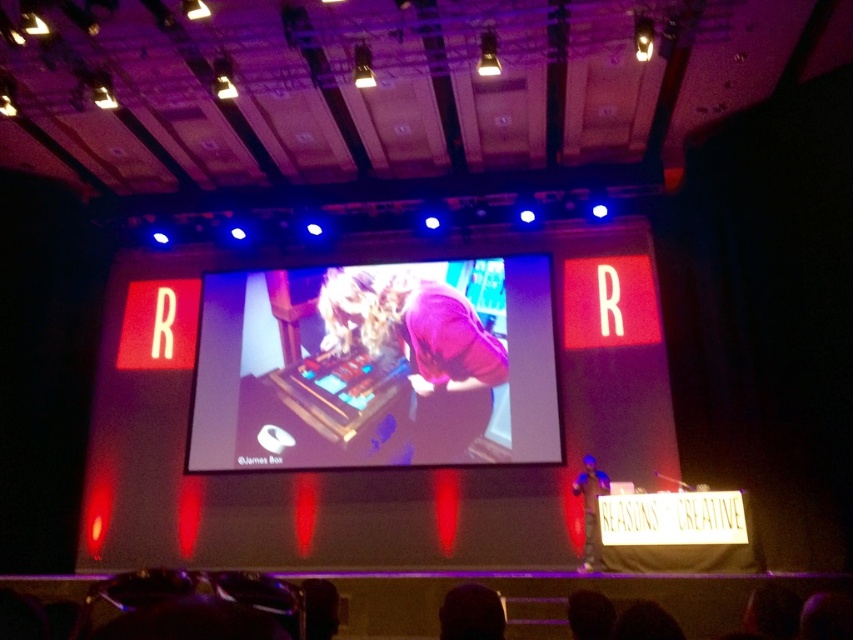
You are a photographer at the event and want to capture the purple matte shirt at center and the matte pink shirt at center clearly. Which shirt should you focus on to ensure the other is also in sharp focus?

The purple matte shirt at center is positioned over the matte pink shirt at center, so focusing on the purple matte shirt at center will keep both in sharp focus since they are layered.

You are an event photographer capturing the stage setup. You notice the dark hair at lower center and the matte pink shirt at center. Which object has a smaller width?

The dark hair at lower center is thinner than the matte pink shirt at center, so the dark hair at lower center has a smaller width.

You are an event organizer who needs to place a 3.5 meter long banner between the purple matte shirt at center and the matte pink shirt at center on stage. Will the banner fit without overlapping either shirt?

The distance between the purple matte shirt at center and the matte pink shirt at center is 2.82 meters. Since the banner is 3.5 meters long, it will not fit as it is longer than the available space between them. The banner would overlap both shirts.